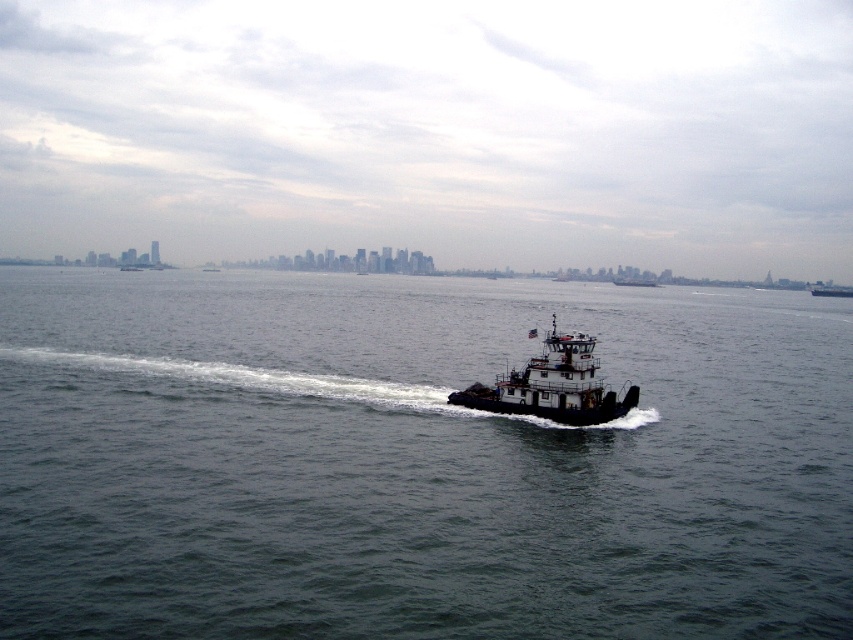
Is dark gray metallic tugboat at center to the right of metallic gray tugboat at center from the viewer's perspective?

Correct, you'll find dark gray metallic tugboat at center to the right of metallic gray tugboat at center.

Does dark gray metallic tugboat at center come in front of metallic gray tugboat at center?

Yes, dark gray metallic tugboat at center is closer to the viewer.

Who is more forward, (850, 291) or (618, 282)?

Positioned in front is point (850, 291).

This screenshot has height=640, width=853. In order to click on dark gray metallic tugboat at center in this screenshot , I will do `click(830, 291)`.

Is black matte tugboat at center in front of metallic gray tugboat at center?

Yes.

Is black matte tugboat at center shorter than metallic gray tugboat at center?

Indeed, black matte tugboat at center has a lesser height compared to metallic gray tugboat at center.

Is point (590, 412) positioned before point (653, 284)?

Yes, point (590, 412) is closer to viewer.

What are the coordinates of `black matte tugboat at center` in the screenshot? It's located at (552, 385).

Can you confirm if dark gray water at center is thinner than dark gray metallic tugboat at center?

In fact, dark gray water at center might be wider than dark gray metallic tugboat at center.

Which is above, dark gray water at center or dark gray metallic tugboat at center?

dark gray metallic tugboat at center is above.

What do you see at coordinates (415, 460) in the screenshot? The height and width of the screenshot is (640, 853). I see `dark gray water at center` at bounding box center [415, 460].

Image resolution: width=853 pixels, height=640 pixels. I want to click on dark gray water at center, so click(415, 460).